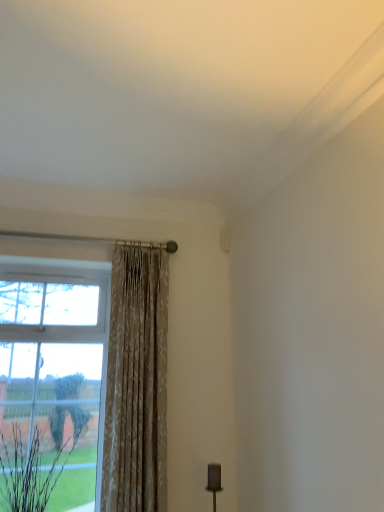
Question: From the image's perspective, is floral fabric curtain at left positioned above or below brown textured plant at lower left?

Choices:
 (A) below
 (B) above

Answer: (B)

Question: Is floral fabric curtain at left bigger or smaller than brown textured plant at lower left?

Choices:
 (A) small
 (B) big

Answer: (B)

Question: Is floral fabric curtain at left taller or shorter than brown textured plant at lower left?

Choices:
 (A) tall
 (B) short

Answer: (A)

Question: In terms of size, does brown textured plant at lower left appear bigger or smaller than floral fabric curtain at left?

Choices:
 (A) small
 (B) big

Answer: (A)

Question: Relative to floral fabric curtain at left, is brown textured plant at lower left in front or behind?

Choices:
 (A) front
 (B) behind

Answer: (A)

Question: Is brown textured plant at lower left situated inside floral fabric curtain at left or outside?

Choices:
 (A) outside
 (B) inside

Answer: (A)

Question: From a real-world perspective, is brown textured plant at lower left above or below floral fabric curtain at left?

Choices:
 (A) above
 (B) below

Answer: (B)